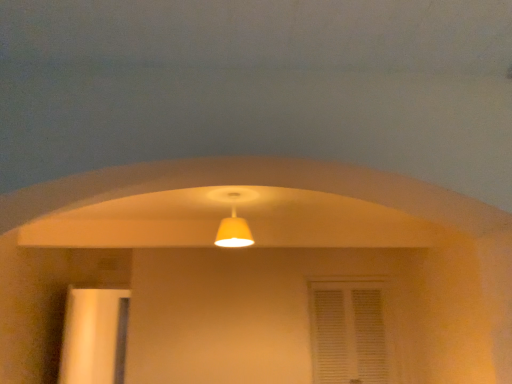
Question: From the image's perspective, is wooden door at left located above matte yellow lampshade at center?

Choices:
 (A) no
 (B) yes

Answer: (A)

Question: Considering the relative sizes of wooden door at left and matte yellow lampshade at center in the image provided, is wooden door at left taller than matte yellow lampshade at center?

Choices:
 (A) no
 (B) yes

Answer: (B)

Question: Is wooden door at left to the left of matte yellow lampshade at center from the viewer's perspective?

Choices:
 (A) yes
 (B) no

Answer: (A)

Question: Considering the relative sizes of wooden door at left and matte yellow lampshade at center in the image provided, is wooden door at left smaller than matte yellow lampshade at center?

Choices:
 (A) no
 (B) yes

Answer: (A)

Question: Is wooden door at left positioned behind matte yellow lampshade at center?

Choices:
 (A) no
 (B) yes

Answer: (B)

Question: From a real-world perspective, is white textured window at center positioned above or below wooden door at left?

Choices:
 (A) above
 (B) below

Answer: (A)

Question: Is white textured window at center in front of or behind wooden door at left in the image?

Choices:
 (A) front
 (B) behind

Answer: (A)

Question: Is point (321, 380) closer or farther from the camera than point (118, 304)?

Choices:
 (A) closer
 (B) farther

Answer: (A)

Question: In terms of height, does white textured window at center look taller or shorter compared to wooden door at left?

Choices:
 (A) short
 (B) tall

Answer: (A)

Question: Is wooden door at left inside or outside of white textured window at center?

Choices:
 (A) inside
 (B) outside

Answer: (B)

Question: Considering the positions of point (83, 375) and point (345, 304), is point (83, 375) closer or farther from the camera than point (345, 304)?

Choices:
 (A) closer
 (B) farther

Answer: (A)

Question: Is wooden door at left in front of or behind white textured window at center in the image?

Choices:
 (A) behind
 (B) front

Answer: (A)

Question: Visually, is wooden door at left positioned to the left or to the right of white textured window at center?

Choices:
 (A) right
 (B) left

Answer: (B)

Question: Which is correct: matte yellow lampshade at center is inside wooden door at left, or outside of it?

Choices:
 (A) outside
 (B) inside

Answer: (A)

Question: From their relative heights in the image, would you say matte yellow lampshade at center is taller or shorter than wooden door at left?

Choices:
 (A) tall
 (B) short

Answer: (B)